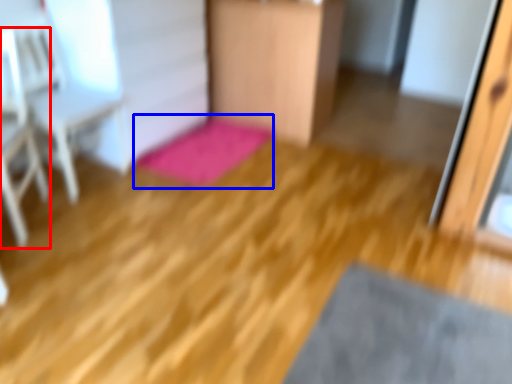
Question: Which of the following is the farthest to the observer, armchair (highlighted by a red box) or bath mat (highlighted by a blue box)?

Choices:
 (A) armchair
 (B) bath mat

Answer: (B)